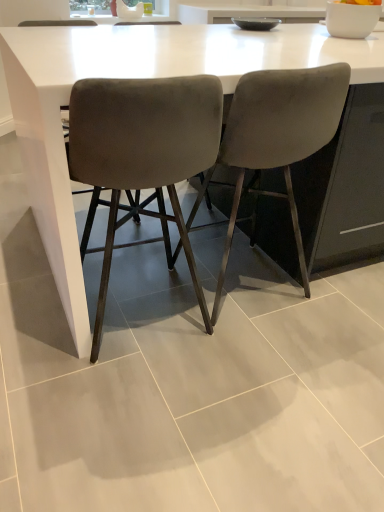
Question: Which direction should I rotate to face velvet grey chair at center, the second chair in the right-to-left sequence, — up or down?

Choices:
 (A) down
 (B) up

Answer: (B)

Question: Is velvet grey chair at center, the second chair in the right-to-left sequence, facing towards velvet grey chair at center, placed as the first chair when sorted from right to left?

Choices:
 (A) no
 (B) yes

Answer: (A)

Question: Could velvet grey chair at center, placed as the first chair when sorted from right to left, be considered to be inside velvet grey chair at center, the second chair in the right-to-left sequence?

Choices:
 (A) yes
 (B) no

Answer: (B)

Question: Is the position of velvet grey chair at center, which appears as the 1th chair when viewed from the left, more distant than that of velvet grey chair at center, placed as the first chair when sorted from right to left?

Choices:
 (A) yes
 (B) no

Answer: (B)

Question: Can you confirm if velvet grey chair at center, which appears as the 1th chair when viewed from the left, is smaller than velvet grey chair at center, the second chair when ordered from left to right?

Choices:
 (A) no
 (B) yes

Answer: (B)

Question: Considering the relative sizes of velvet grey chair at center, which appears as the 1th chair when viewed from the left, and velvet grey chair at center, the second chair when ordered from left to right, in the image provided, is velvet grey chair at center, which appears as the 1th chair when viewed from the left, shorter than velvet grey chair at center, the second chair when ordered from left to right,?

Choices:
 (A) yes
 (B) no

Answer: (A)

Question: From the image's perspective, is velvet grey chair at center, the second chair in the right-to-left sequence, beneath velvet grey chair at center, the second chair when ordered from left to right?

Choices:
 (A) no
 (B) yes

Answer: (B)

Question: Does velvet grey chair at center, the second chair when ordered from left to right, come behind velvet grey chair at center, the second chair in the right-to-left sequence?

Choices:
 (A) yes
 (B) no

Answer: (A)

Question: From the image's perspective, is velvet grey chair at center, placed as the first chair when sorted from right to left, on top of velvet grey chair at center, which appears as the 1th chair when viewed from the left?

Choices:
 (A) no
 (B) yes

Answer: (B)

Question: Can you confirm if velvet grey chair at center, placed as the first chair when sorted from right to left, is wider than velvet grey chair at center, which appears as the 1th chair when viewed from the left?

Choices:
 (A) yes
 (B) no

Answer: (A)

Question: From a real-world perspective, is velvet grey chair at center, the second chair when ordered from left to right, over velvet grey chair at center, which appears as the 1th chair when viewed from the left?

Choices:
 (A) yes
 (B) no

Answer: (A)

Question: Does velvet grey chair at center, placed as the first chair when sorted from right to left, have a lesser height compared to velvet grey chair at center, which appears as the 1th chair when viewed from the left?

Choices:
 (A) yes
 (B) no

Answer: (B)

Question: Does velvet grey chair at center, placed as the first chair when sorted from right to left, have a smaller size compared to velvet grey chair at center, the second chair in the right-to-left sequence?

Choices:
 (A) yes
 (B) no

Answer: (B)

Question: From the image's perspective, is velvet grey chair at center, which appears as the 1th chair when viewed from the left, beneath white glossy table at center?

Choices:
 (A) no
 (B) yes

Answer: (B)